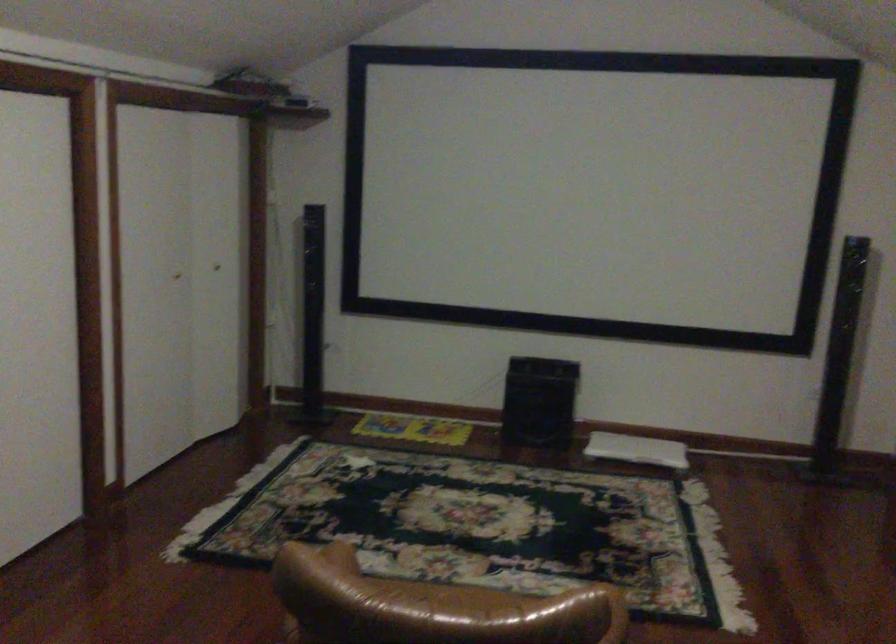
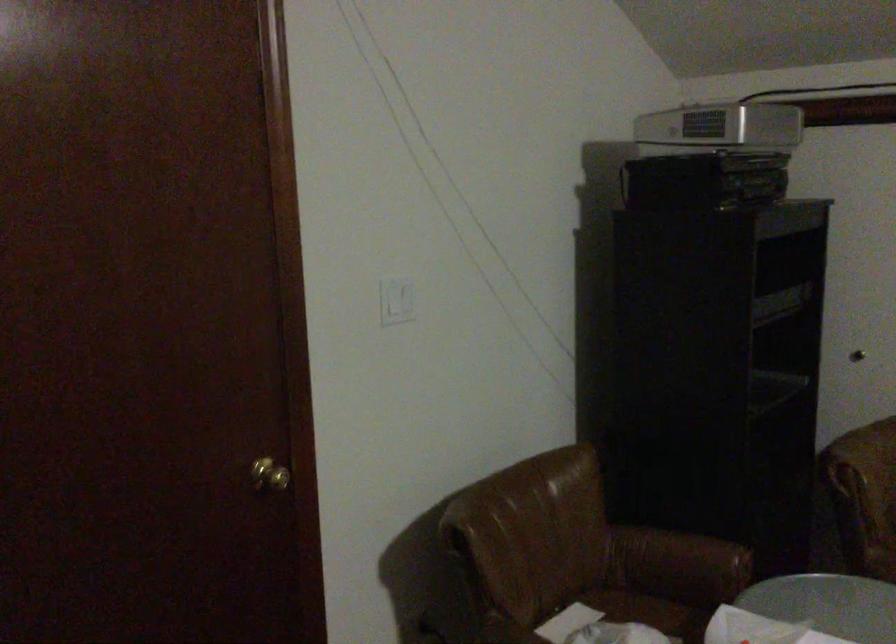
Question: Based on the continuous images, in which direction is the camera rotating? Reply with the corresponding letter.

Choices:
 (A) Left
 (B) Right
 (C) Up
 (D) Down

Answer: (A)